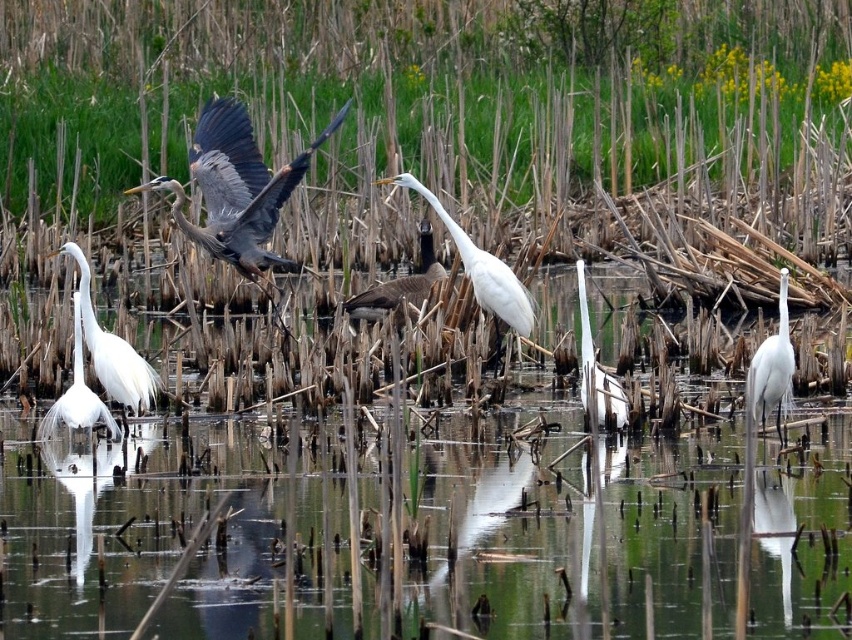
Is clear water at center taller than gray feathered heron at left?

In fact, clear water at center may be shorter than gray feathered heron at left.

Between clear water at center and gray feathered heron at left, which one has less height?

clear water at center

Does point (378, 508) come farther from viewer compared to point (242, 198)?

No.

Locate an element on the screen. This screenshot has height=640, width=852. clear water at center is located at coordinates (366, 540).

Does white matte egret at lower left appear on the left side of white matte heron at lower left?

In fact, white matte egret at lower left is to the right of white matte heron at lower left.

From the picture: Is white matte egret at lower left taller than white matte heron at lower left?

Indeed, white matte egret at lower left has a greater height compared to white matte heron at lower left.

Where is `white matte egret at lower left`? The height and width of the screenshot is (640, 852). white matte egret at lower left is located at coordinates (112, 349).

Is white matte bird at center taller than brown matte goose at center?

Indeed, white matte bird at center has a greater height compared to brown matte goose at center.

Consider the image. Which of these two, white matte bird at center or brown matte goose at center, stands taller?

Standing taller between the two is white matte bird at center.

Measure the distance between point (481, 252) and camera.

Point (481, 252) and camera are 10.44 meters apart.

This screenshot has height=640, width=852. In order to click on white matte bird at center in this screenshot , I will do `click(481, 269)`.